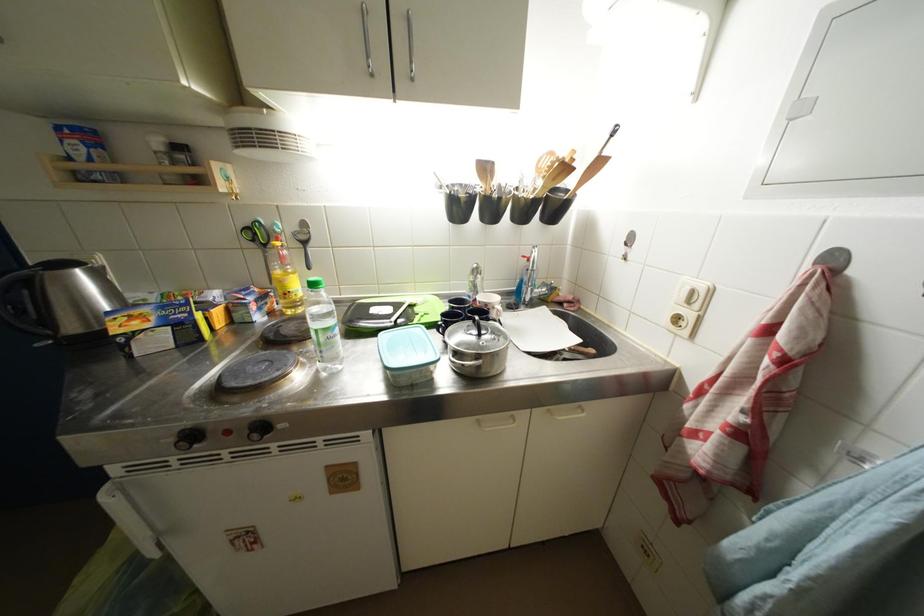
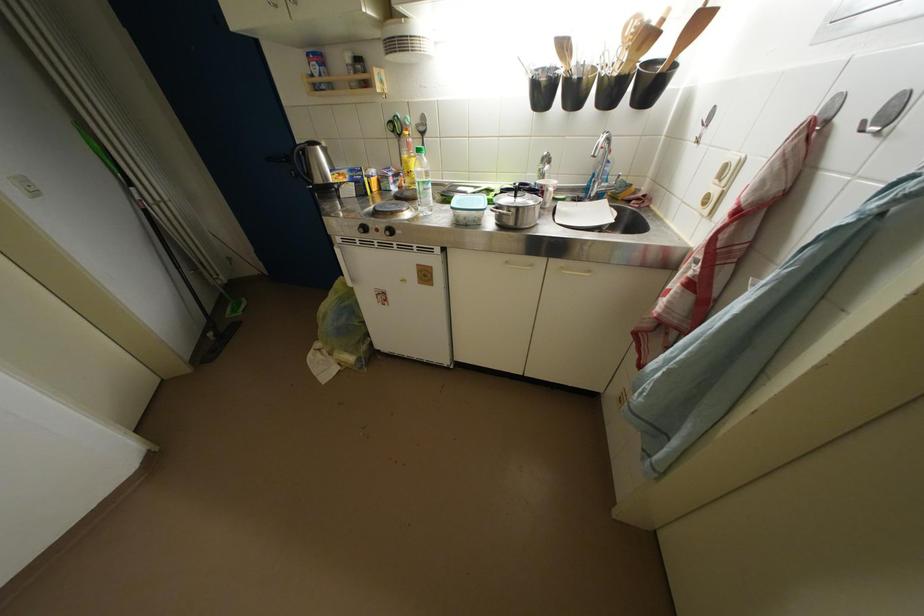
Find the pixel in the second image that matches the point at 485,424 in the first image.

(514, 265)